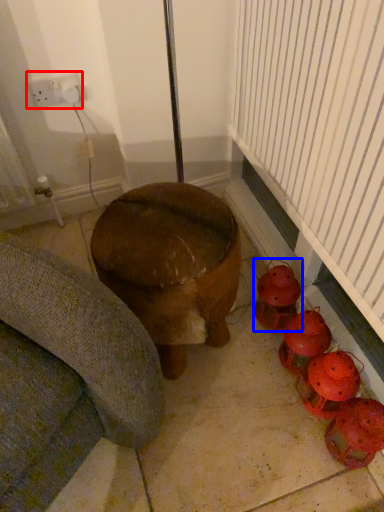
Question: Among these objects, which one is nearest to the camera, electric outlet (highlighted by a red box) or toy (highlighted by a blue box)?

Choices:
 (A) electric outlet
 (B) toy

Answer: (B)